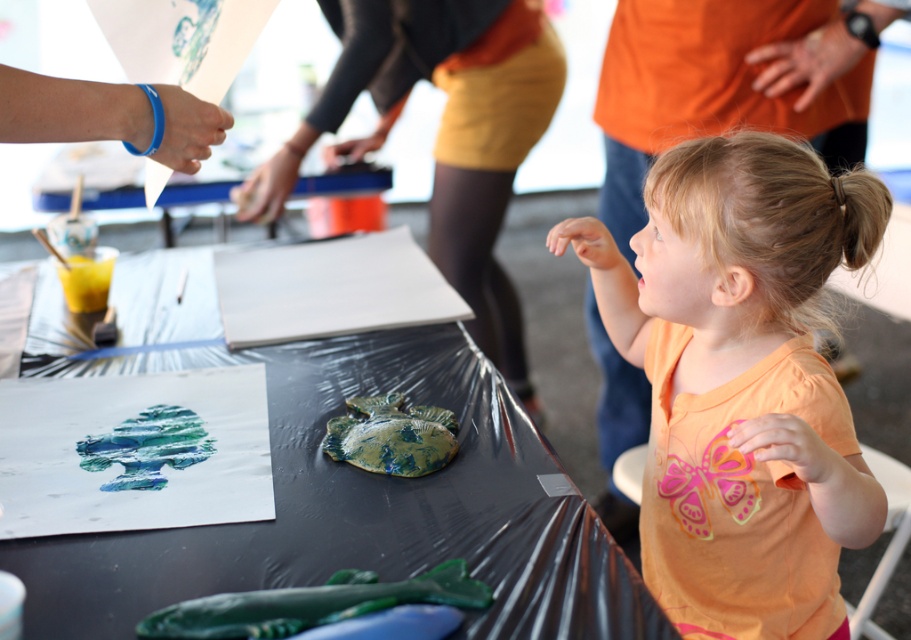
Question: Can you confirm if green clay fish at center is positioned to the left of green textured clay turtle at center?

Choices:
 (A) no
 (B) yes

Answer: (B)

Question: Does shiny plastic table at center appear over blonde hair at upper right?

Choices:
 (A) yes
 (B) no

Answer: (B)

Question: Estimate the real-world distances between objects in this image. Which object is closer to the green clay fish at center?

Choices:
 (A) blonde hair at upper right
 (B) matte yellow skirt at center
 (C) green textured clay turtle at center

Answer: (C)

Question: In this image, where is green textured clay turtle at center located relative to blonde hair at upper right?

Choices:
 (A) below
 (B) above

Answer: (A)

Question: Which object is positioned farthest from the blonde hair at upper right?

Choices:
 (A) green clay fish at center
 (B) shiny plastic table at center
 (C) blue rubber bracelet at upper left
 (D) orange cotton shirt at center

Answer: (C)

Question: Which object is positioned closest to the blonde hair at upper right?

Choices:
 (A) blue rubber bracelet at upper left
 (B) green textured clay turtle at center
 (C) shiny plastic table at center

Answer: (B)